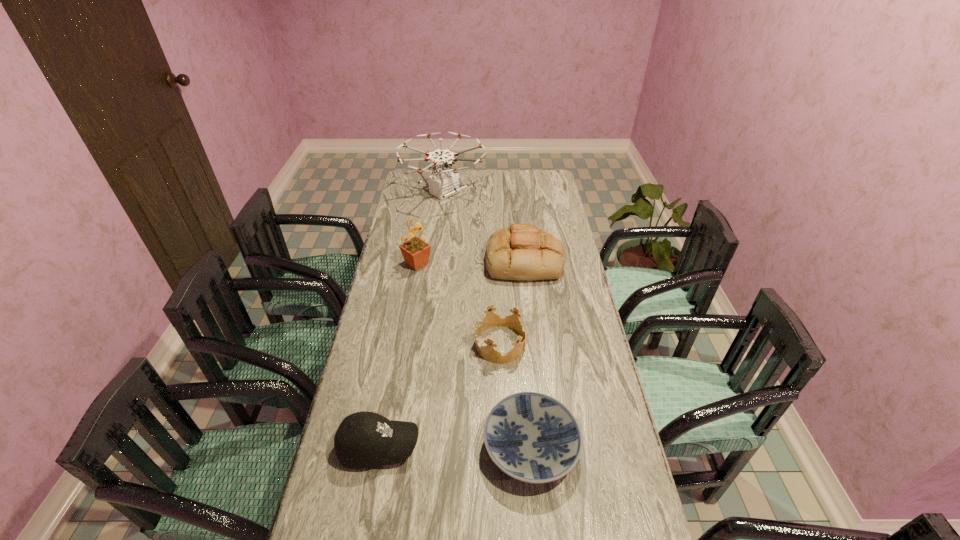
This screenshot has height=540, width=960. Find the location of `vacant area that lies between the bread and the plate`. vacant area that lies between the bread and the plate is located at coordinates (527, 354).

Image resolution: width=960 pixels, height=540 pixels. I want to click on vacant space in between the bread and the plate, so click(x=527, y=354).

The width and height of the screenshot is (960, 540). Find the location of `empty space that is in between the drone and the third tallest object`. empty space that is in between the drone and the third tallest object is located at coordinates (484, 227).

At what (x,y) coordinates should I click in order to perform the action: click on free space between the bread and the tallest object. Please return your answer as a coordinate pair (x, y). Looking at the image, I should click on (484, 227).

Where is `vacant space in between the baseball cap and the bread`? The image size is (960, 540). vacant space in between the baseball cap and the bread is located at coordinates pyautogui.click(x=451, y=354).

Locate an element on the screen. empty location between the bread and the sunflower is located at coordinates (470, 262).

The image size is (960, 540). Find the location of `object that is the third nearest to the drone`. object that is the third nearest to the drone is located at coordinates (491, 319).

Locate an element on the screen. This screenshot has height=540, width=960. object that is the closest one to the tallest object is located at coordinates (522, 252).

In order to click on vacant space that satisfies the following two spatial constraints: 1. on the back side of the shortest object; 2. at the front of the fifth shortest object with flowers visible in this screenshot , I will do `click(514, 264)`.

Find the location of `vacant point that satisfies the following two spatial constraints: 1. on the back side of the fourth shortest object; 2. on the left side of the shortest object`. vacant point that satisfies the following two spatial constraints: 1. on the back side of the fourth shortest object; 2. on the left side of the shortest object is located at coordinates (514, 261).